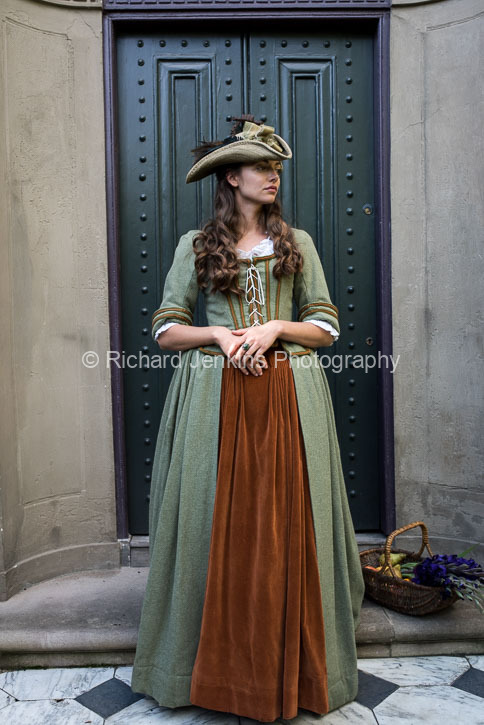
I want to click on basket, so click(404, 600).